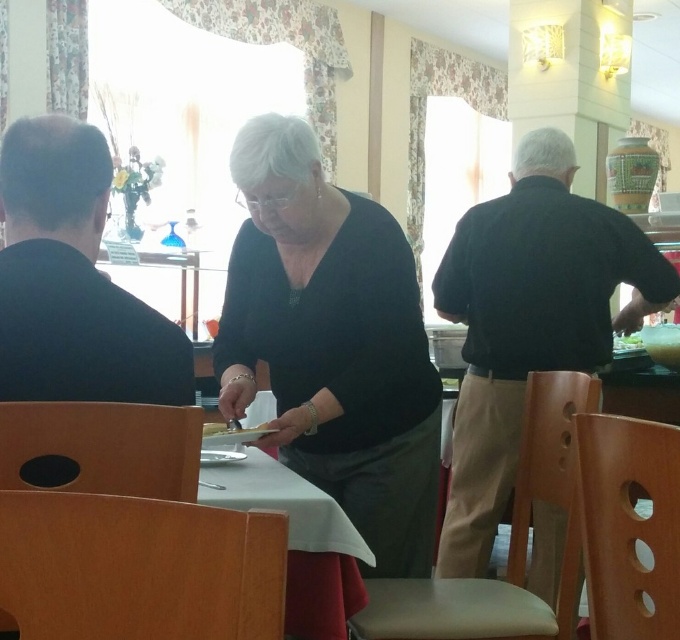
Question: Does black matte dress at center appear on the right side of light brown wooden chair at center?

Choices:
 (A) no
 (B) yes

Answer: (A)

Question: Is black matte dress at center to the right of wooden chair at lower right from the viewer's perspective?

Choices:
 (A) no
 (B) yes

Answer: (A)

Question: Is black matte jacket at left in front of light brown wooden chair at center?

Choices:
 (A) no
 (B) yes

Answer: (B)

Question: Among these points, which one is farthest from the camera?

Choices:
 (A) (141, 376)
 (B) (483, 534)
 (C) (466, 596)

Answer: (B)

Question: Which object appears farthest from the camera in this image?

Choices:
 (A) wooden chair at lower right
 (B) dark brown leather jacket at right
 (C) wooden chair at lower left

Answer: (B)

Question: Which object is closer to the camera taking this photo?

Choices:
 (A) wooden chair at lower left
 (B) black matte dress at center
 (C) wooden chair at lower center

Answer: (C)